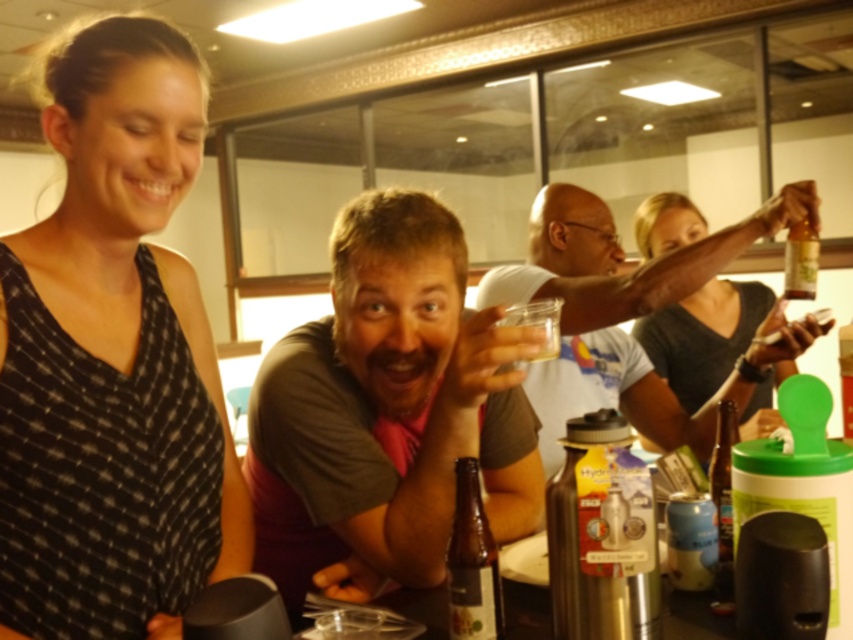
Question: Can you confirm if black checkered dress at upper left is wider than translucent glass bottle at lower right?

Choices:
 (A) no
 (B) yes

Answer: (B)

Question: Is black checkered dress at upper left wider than brown glass bottle at lower center?

Choices:
 (A) no
 (B) yes

Answer: (B)

Question: Which is nearer to the brown glass bottle at lower center?

Choices:
 (A) brown cotton shirt at center
 (B) silver metallic thermos at lower center

Answer: (B)

Question: Which point appears closest to the camera in this image?

Choices:
 (A) (459, 397)
 (B) (630, 348)

Answer: (A)

Question: Does matte black arm at upper right appear on the right side of brown glass bottle at lower center?

Choices:
 (A) yes
 (B) no

Answer: (A)

Question: Which of the following is the farthest from the observer?

Choices:
 (A) brown glass bottle at lower center
 (B) translucent glass bottle at lower right

Answer: (B)